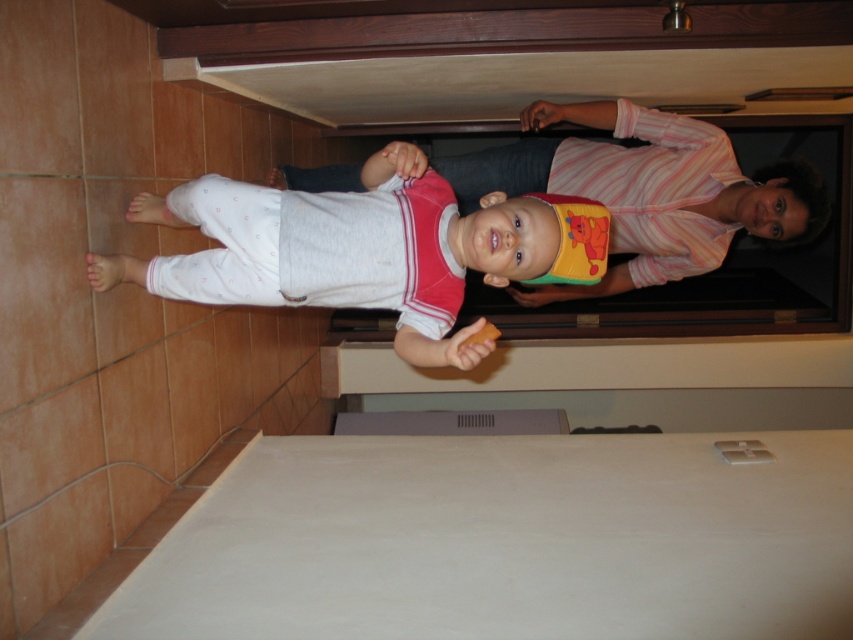
In the scene shown: You are a babysitter who needs to ensure the safety of the white soft baby at center and the white cotton bib at center. Based on their sizes, which item might be more challenging to keep track of and why?

The white soft baby at center is not as tall as the white cotton bib at center, so the baby might be harder to keep track of because it is smaller in size.

You are standing in the doorway and want to reach both points. Which point, point (409, 333) or point (550, 296), is closer to you?

Point (409, 333) is closer to the viewer than point (550, 296).